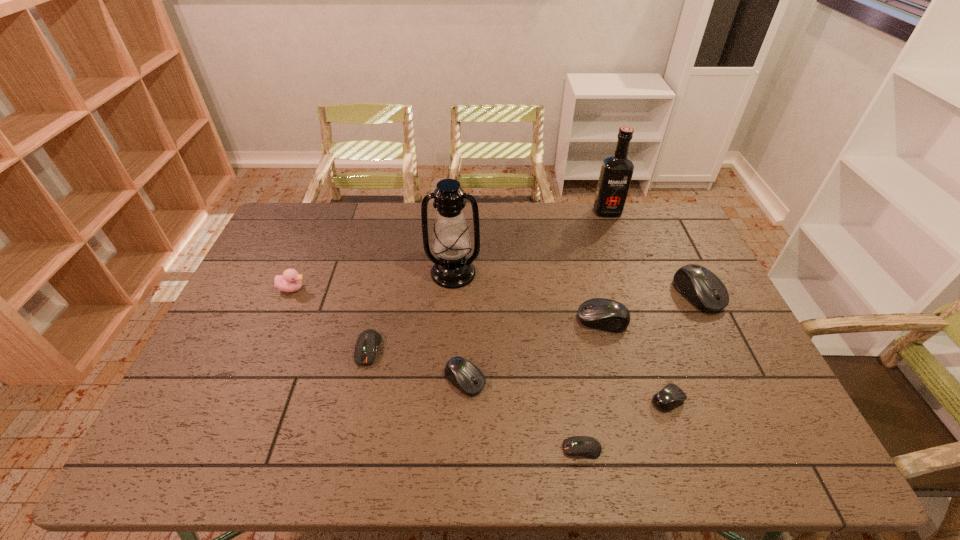
The width and height of the screenshot is (960, 540). Find the location of `the third biggest black mouse`. the third biggest black mouse is located at coordinates (468, 378).

This screenshot has height=540, width=960. In order to click on the farther dark computer equipment in this screenshot , I will do `click(368, 341)`.

The height and width of the screenshot is (540, 960). I want to click on the bigger dark computer equipment, so click(368, 341).

Identify the location of the smallest black mouse. The width and height of the screenshot is (960, 540). (671, 396).

You are a GUI agent. You are given a task and a screenshot of the screen. Output one action in this format:
    pyautogui.click(x=<x>, y=<y>)
    Task: Click on the nearest computer equipment
    
    Given the screenshot: What is the action you would take?
    pyautogui.click(x=585, y=446)

Locate an element on the screen. the smaller dark computer equipment is located at coordinates (585, 446).

This screenshot has height=540, width=960. In order to click on free space located 0.300m on the front-facing side of the farthest object in this screenshot , I will do `click(629, 273)`.

Find the location of a particular element. The height and width of the screenshot is (540, 960). vacant region located 0.150m on the right of the black oil lamp is located at coordinates (525, 273).

Identify the location of vacant space located on the front-facing side of the duckling. (330, 289).

I want to click on free space located 0.290m on the front of the rightmost black mouse, so click(751, 403).